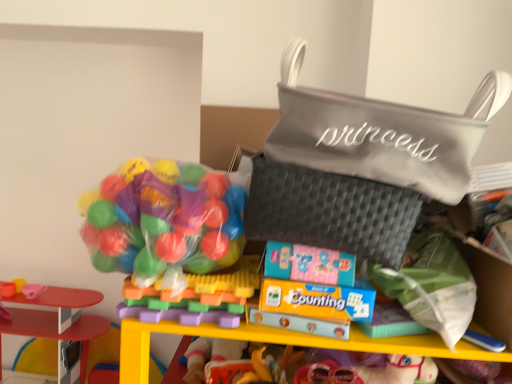
Question: Can you confirm if green fabric pouch at lower right, which is the 1th pouch in bottom-to-top order, is smaller than smooth plastic cup at left, which is the 2th toy in bottom-to-top order?

Choices:
 (A) no
 (B) yes

Answer: (A)

Question: Does green fabric pouch at lower right, which is the 1th pouch in bottom-to-top order, appear on the left side of smooth plastic cup at left, placed as the 3th toy when sorted from front to back?

Choices:
 (A) no
 (B) yes

Answer: (A)

Question: Is the depth of green fabric pouch at lower right, which is the 1th pouch in bottom-to-top order, less than that of smooth plastic cup at left, the second toy in the top-to-bottom sequence?

Choices:
 (A) no
 (B) yes

Answer: (B)

Question: Is green fabric pouch at lower right, which is the 1th pouch in bottom-to-top order, looking in the opposite direction of smooth plastic cup at left, placed as the 3th toy when sorted from front to back?

Choices:
 (A) no
 (B) yes

Answer: (A)

Question: Can you confirm if green fabric pouch at lower right, the 3th pouch from the top, is shorter than smooth plastic cup at left, the second toy in the top-to-bottom sequence?

Choices:
 (A) yes
 (B) no

Answer: (B)

Question: Is green fabric pouch at lower right, the 3th pouch from the top, not inside smooth plastic cup at left, the 1th toy positioned from the left?

Choices:
 (A) yes
 (B) no

Answer: (A)

Question: Is gray quilted pouch at upper right, placed as the third pouch when sorted from bottom to top, oriented away from translucent plastic balls at left, the 3th toy viewed from the back?

Choices:
 (A) no
 (B) yes

Answer: (A)

Question: Is gray quilted pouch at upper right, which ranks as the 1th pouch in top-to-bottom order, closer to camera compared to translucent plastic balls at left, which is the 1th toy from right to left?

Choices:
 (A) yes
 (B) no

Answer: (A)

Question: Does gray quilted pouch at upper right, placed as the third pouch when sorted from bottom to top, appear on the left side of translucent plastic balls at left, which is the 1th toy from right to left?

Choices:
 (A) no
 (B) yes

Answer: (A)

Question: Considering the relative sizes of gray quilted pouch at upper right, placed as the third pouch when sorted from bottom to top, and translucent plastic balls at left, the 3th toy positioned from the bottom, in the image provided, is gray quilted pouch at upper right, placed as the third pouch when sorted from bottom to top, shorter than translucent plastic balls at left, the 3th toy positioned from the bottom,?

Choices:
 (A) yes
 (B) no

Answer: (B)

Question: Is gray quilted pouch at upper right, placed as the third pouch when sorted from bottom to top, facing towards translucent plastic balls at left, the 1th toy viewed from the top?

Choices:
 (A) yes
 (B) no

Answer: (B)

Question: Does gray quilted pouch at upper right, placed as the third pouch when sorted from bottom to top, lie behind translucent plastic balls at left, which is the 1th toy from right to left?

Choices:
 (A) no
 (B) yes

Answer: (A)

Question: Is green fabric pouch at lower right, the 3th pouch from the top, not close to translucent plastic balls at left, the 3th toy viewed from the back?

Choices:
 (A) no
 (B) yes

Answer: (A)